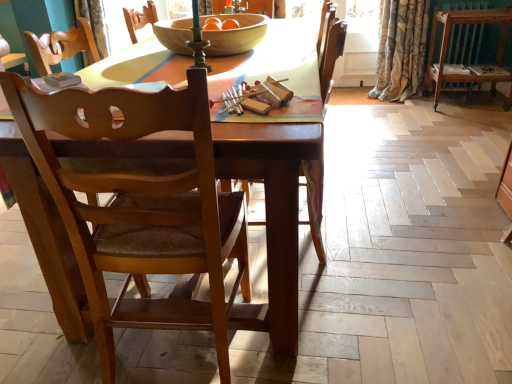
In order to face brown wood dresser at right, should I rotate leftwards or rightwards?

Rotate right and turn 26.932 degrees.

What is the approximate width of wooden bowl at center?

It is 20.98 inches.

Identify the location of floral velvet curtain at upper right. (401, 50).

Where is `brown wood dresser at right`? The height and width of the screenshot is (384, 512). brown wood dresser at right is located at coordinates (460, 64).

How different are the orientations of brown wooden radiator at upper right and wooden chair at center, which appears as the 2th chair when viewed from the right, in degrees?

The angle between the facing direction of brown wooden radiator at upper right and the facing direction of wooden chair at center, which appears as the 2th chair when viewed from the right, is 179 degrees.

Relative to wooden chair at center, which appears as the 2th chair when viewed from the right, is brown wooden radiator at upper right in front or behind?

brown wooden radiator at upper right is positioned farther from the viewer than wooden chair at center, which appears as the 2th chair when viewed from the right.

From the image's perspective, which object appears higher, brown wooden radiator at upper right or wooden chair at center, which appears as the 2th chair when viewed from the right?

brown wooden radiator at upper right, from the image's perspective.

Considering the relative sizes of brown wooden radiator at upper right and wooden chair at center, which appears as the 2th chair when viewed from the right, in the image provided, is brown wooden radiator at upper right shorter than wooden chair at center, which appears as the 2th chair when viewed from the right,?

Yes.

Does wooden chair at center, the first chair in the left-to-right sequence, lie in front of floral velvet curtain at upper right?

Yes.

Between point (68, 134) and point (404, 90), which one is positioned in front?

The point (68, 134) is more forward.

Is floral velvet curtain at upper right a part of wooden chair at center, which appears as the 2th chair when viewed from the right?

Definitely not — floral velvet curtain at upper right is not inside wooden chair at center, which appears as the 2th chair when viewed from the right.

Is floral velvet curtain at upper right taller than brown wood dresser at right?

Correct, floral velvet curtain at upper right is much taller as brown wood dresser at right.

From the image's perspective, is floral velvet curtain at upper right under brown wood dresser at right?

No, from the image's perspective, floral velvet curtain at upper right is not beneath brown wood dresser at right.

Can you see floral velvet curtain at upper right touching brown wood dresser at right?

floral velvet curtain at upper right and brown wood dresser at right are clearly separated.

Is point (397, 37) closer or farther from the camera than point (503, 53)?

Point (397, 37) appears to be closer to the viewer than point (503, 53).

From the picture: Is wooden chair at center, which appears as the 2th chair when viewed from the right, taller than brown wooden radiator at upper right?

Correct, wooden chair at center, which appears as the 2th chair when viewed from the right, is much taller as brown wooden radiator at upper right.

Is wooden chair at center, which appears as the 2th chair when viewed from the right, outside of brown wooden radiator at upper right?

Absolutely, wooden chair at center, which appears as the 2th chair when viewed from the right, is external to brown wooden radiator at upper right.

From the picture: Between wooden chair at center, the first chair in the left-to-right sequence, and brown wooden radiator at upper right, which one has larger size?

With larger size is wooden chair at center, the first chair in the left-to-right sequence.

Can we say brown wooden radiator at upper right lies outside brown wood dresser at right?

That's correct, brown wooden radiator at upper right is outside of brown wood dresser at right.

In the image, is brown wooden radiator at upper right positioned in front of or behind brown wood dresser at right?

brown wooden radiator at upper right is positioned farther from the viewer than brown wood dresser at right.

How different are the orientations of brown wooden radiator at upper right and brown wood dresser at right in degrees?

There is a 0.00108-degree angle between the facing directions of brown wooden radiator at upper right and brown wood dresser at right.

How many degrees apart are the facing directions of wooden chair at center, which is counted as the 2th chair, starting from the left, and brown wood dresser at right?

The angular difference between wooden chair at center, which is counted as the 2th chair, starting from the left, and brown wood dresser at right is 89.1 degrees.

Is wooden chair at center, the first chair from the right, not near brown wood dresser at right?

Yes, wooden chair at center, the first chair from the right, is far from brown wood dresser at right.

Can you confirm if wooden chair at center, which is counted as the 2th chair, starting from the left, is shorter than brown wood dresser at right?

Incorrect, the height of wooden chair at center, which is counted as the 2th chair, starting from the left, does not fall short of that of brown wood dresser at right.

Is wooden chair at center, the first chair from the right, aimed at brown wood dresser at right?

No, wooden chair at center, the first chair from the right, is not turned towards brown wood dresser at right.

Locate an element on the screen. The height and width of the screenshot is (384, 512). dresser above the wooden chair at center, which appears as the 2th chair when viewed from the right (from the image's perspective) is located at coordinates (460, 64).

Could you tell me if wooden chair at center, the first chair in the left-to-right sequence, is turned towards brown wood dresser at right?

No, wooden chair at center, the first chair in the left-to-right sequence, is not oriented towards brown wood dresser at right.

Considering the sizes of wooden chair at center, the first chair in the left-to-right sequence, and brown wood dresser at right in the image, is wooden chair at center, the first chair in the left-to-right sequence, wider or thinner than brown wood dresser at right?

Considering their sizes, wooden chair at center, the first chair in the left-to-right sequence, looks broader than brown wood dresser at right.

From the picture: Considering the sizes of objects wooden chair at center, the first chair in the left-to-right sequence, and brown wood dresser at right in the image provided, who is shorter, wooden chair at center, the first chair in the left-to-right sequence, or brown wood dresser at right?

With less height is brown wood dresser at right.

I want to click on radiator directly beneath the wooden chair at center, the first chair in the left-to-right sequence (from a real-world perspective), so click(464, 44).

Starting from the floral velvet curtain at upper right, which chair is the 2nd one in front? Please provide its 2D coordinates.

[(141, 206)]

Consider the image. Looking at the image, which one is located further to brown wooden radiator at upper right, wooden chair at center, the first chair in the left-to-right sequence, or wooden chair at center, the first chair from the right?

The object further to brown wooden radiator at upper right is wooden chair at center, the first chair in the left-to-right sequence.

Which object lies nearer to the anchor point brown wooden radiator at upper right, wooden bowl at center or floral velvet curtain at upper right?

The object closer to brown wooden radiator at upper right is floral velvet curtain at upper right.

When comparing their distances from wooden chair at center, the first chair from the right, does wooden bowl at center or brown wooden radiator at upper right seem closer?

The object closer to wooden chair at center, the first chair from the right, is wooden bowl at center.

When comparing their distances from wooden bowl at center, does brown wooden radiator at upper right or brown wood dresser at right seem further?

Among the two, brown wooden radiator at upper right is located further to wooden bowl at center.

Based on their spatial positions, is brown wood dresser at right or brown wooden radiator at upper right closer to wooden bowl at center?

brown wood dresser at right lies closer to wooden bowl at center than the other object.

Which object lies nearer to the anchor point wooden bowl at center, floral velvet curtain at upper right or brown wooden radiator at upper right?

floral velvet curtain at upper right.

When comparing their distances from wooden chair at center, which appears as the 2th chair when viewed from the right, does wooden chair at center, the first chair from the right, or floral velvet curtain at upper right seem further?

floral velvet curtain at upper right lies further to wooden chair at center, which appears as the 2th chair when viewed from the right, than the other object.

Which object lies further to the anchor point wooden chair at center, which appears as the 2th chair when viewed from the right, wooden chair at center, the first chair from the right, or wooden bowl at center?

The object further to wooden chair at center, which appears as the 2th chair when viewed from the right, is wooden bowl at center.

Find the location of a particular element. dresser between wooden chair at center, which appears as the 2th chair when viewed from the right, and floral velvet curtain at upper right from front to back is located at coordinates (460, 64).

Locate an element on the screen. The width and height of the screenshot is (512, 384). curtain situated between wooden bowl at center and brown wooden radiator at upper right from left to right is located at coordinates (401, 50).

Identify the location of dresser between floral velvet curtain at upper right and brown wooden radiator at upper right in the horizontal direction. This screenshot has height=384, width=512. (460, 64).

At what (x,y) coordinates should I click in order to perform the action: click on dresser located between wooden bowl at center and brown wooden radiator at upper right in the left-right direction. Please return your answer as a coordinate pair (x, y). This screenshot has width=512, height=384. Looking at the image, I should click on (460, 64).